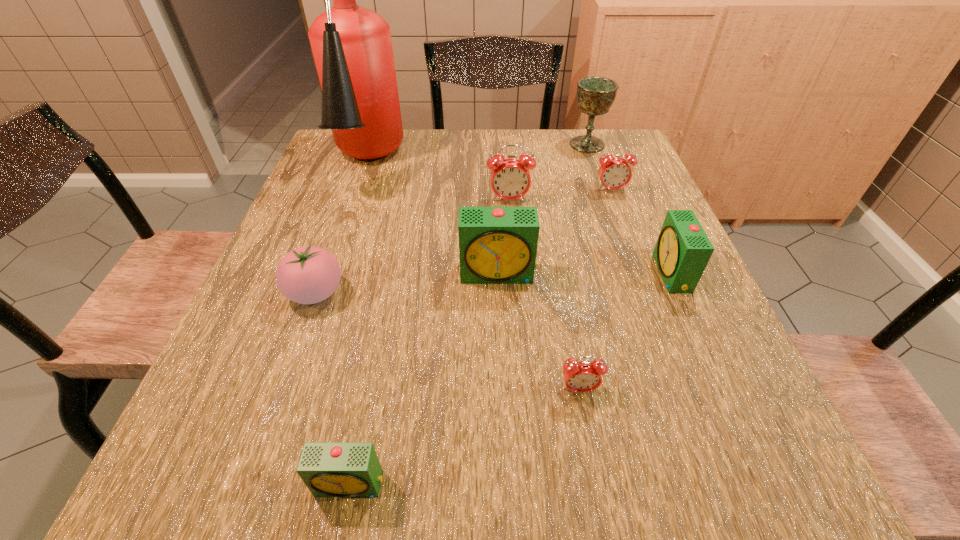
You are a GUI agent. You are given a task and a screenshot of the screen. Output one action in this format:
    pyautogui.click(x=<x>, y=<y>)
    Task: Click on the red alarm clock identified as the third closest to the nearest alarm clock
    The width and height of the screenshot is (960, 540).
    Given the screenshot: What is the action you would take?
    pyautogui.click(x=614, y=173)

Identify which green alarm clock is the closest to the biggest red alarm clock. Please provide its 2D coordinates. Your answer should be formatted as a tuple, i.e. [(x, y)], where the tuple contains the x and y coordinates of a point satisfying the conditions above.

[(497, 245)]

Locate which green alarm clock is the closest to the second green alarm clock from left to right. Please provide its 2D coordinates. Your answer should be formatted as a tuple, i.e. [(x, y)], where the tuple contains the x and y coordinates of a point satisfying the conditions above.

[(683, 250)]

Where is `vacant space that satisfies the following two spatial constraints: 1. on the front-facing side of the second smallest green alarm clock; 2. on the front-facing side of the biggest green alarm clock`? vacant space that satisfies the following two spatial constraints: 1. on the front-facing side of the second smallest green alarm clock; 2. on the front-facing side of the biggest green alarm clock is located at coordinates (672, 274).